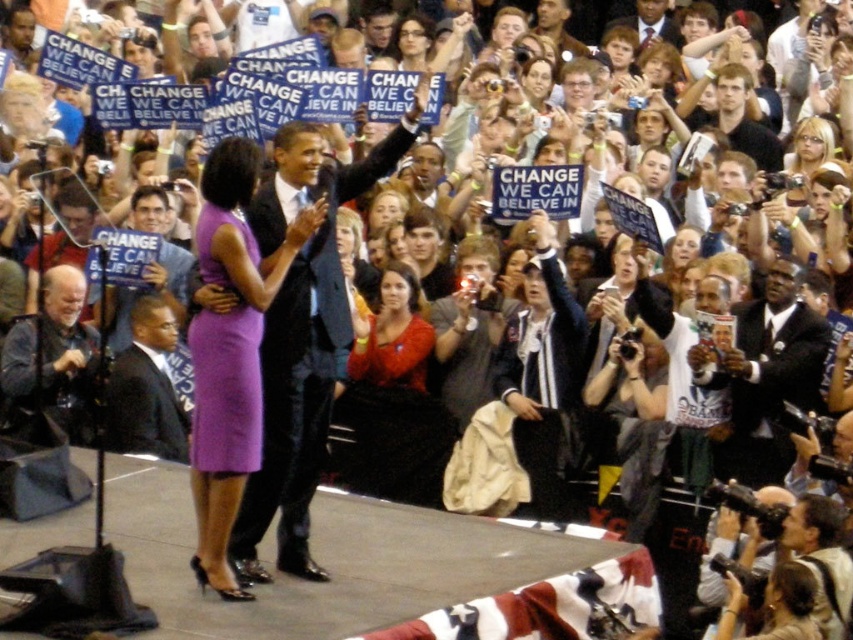
You are a photographer at the rally. You want to take a photo that includes both the matte red dress at center and the gray fabric at lower left. What is the minimum distance you need to move your camera to frame both objects in the shot?

The minimum distance you need to move your camera to frame both the matte red dress at center and the gray fabric at lower left is 15.09 meters.

You are a photographer at the rally and need to focus your camera on the central figure wearing a matte black suit. Given that your camera can only focus on objects within a 0.1 unit radius from the point you select, would the point you choose at coordinates point (x=303, y=337) be sufficient to capture the matte black suit at center?

The point (x=303, y=337) corresponds to the matte black suit at center, so yes, selecting that point would ensure the camera focuses on the matte black suit at center within the required radius.

You are a photographer at the rally and want to take a photo of the matte red dress at center without the gray fabric at lower left blocking it. What should you do?

Move your position to the left so that the gray fabric at lower left is no longer behind the matte red dress at center, allowing you to capture the matte red dress at center clearly.